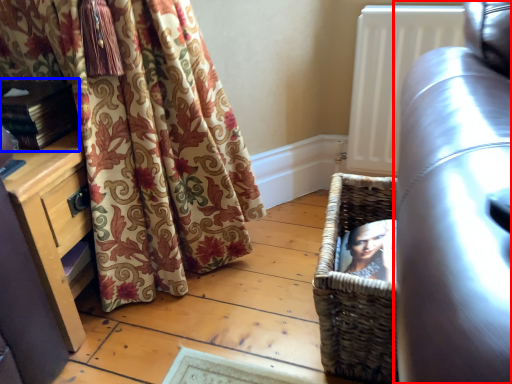
Question: Among these objects, which one is farthest to the camera, studio couch (highlighted by a red box) or book (highlighted by a blue box)?

Choices:
 (A) studio couch
 (B) book

Answer: (B)